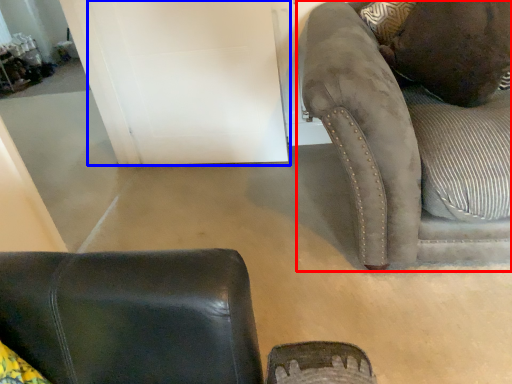
Question: Which of the following is the closest to the observer, studio couch (highlighted by a red box) or door (highlighted by a blue box)?

Choices:
 (A) studio couch
 (B) door

Answer: (A)